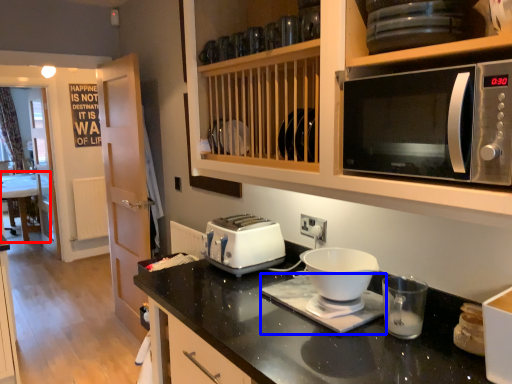
Question: Among these objects, which one is farthest to the camera, table (highlighted by a red box) or appliance (highlighted by a blue box)?

Choices:
 (A) table
 (B) appliance

Answer: (A)